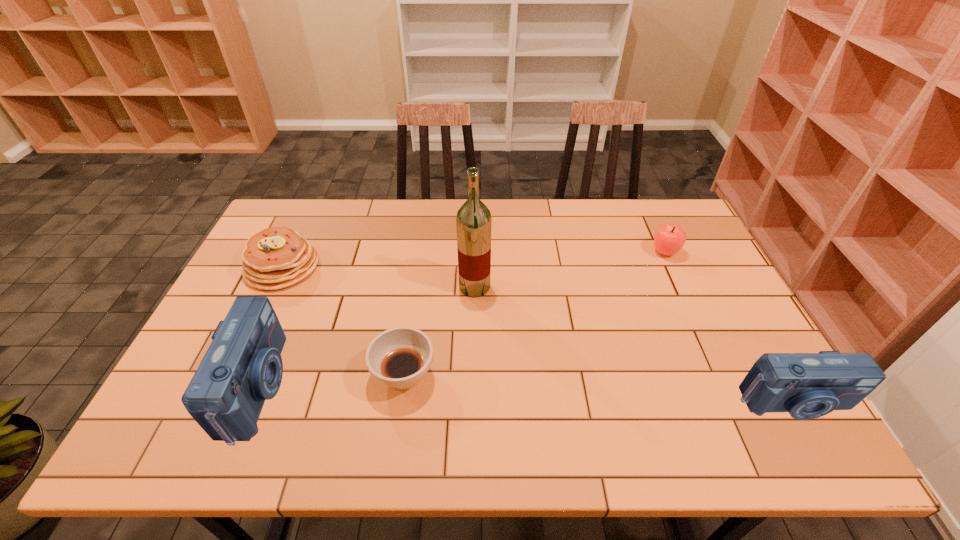
To ensure equal spacing by inserting another camera among them, please point out a vacant spot for this new camera. Please provide its 2D coordinates. Your answer should be formatted as a tuple, i.e. [(x, y)], where the tuple contains the x and y coordinates of a point satisfying the conditions above.

[(522, 395)]